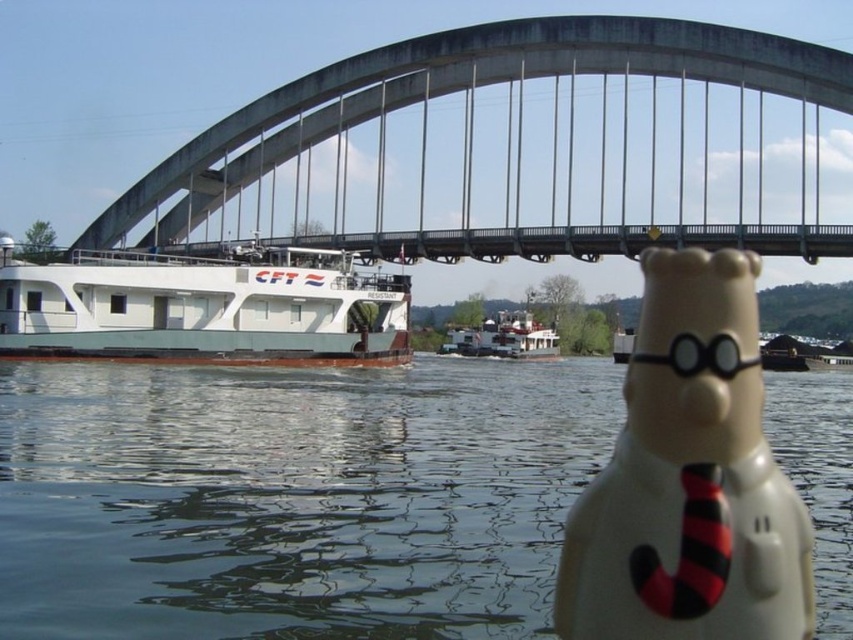
Can you confirm if transparent water at center is bigger than white matte barge at left?

Correct, transparent water at center is larger in size than white matte barge at left.

Is point (537, 545) more distant than point (61, 352)?

That is False.

You are a GUI agent. You are given a task and a screenshot of the screen. Output one action in this format:
    pyautogui.click(x=<x>, y=<y>)
    Task: Click on the transparent water at center
    
    Given the screenshot: What is the action you would take?
    pyautogui.click(x=293, y=497)

Is the position of transparent water at center less distant than that of white matte barge at center?

That is True.

Can you confirm if transparent water at center is positioned to the right of white matte barge at center?

No, transparent water at center is not to the right of white matte barge at center.

What do you see at coordinates (293, 497) in the screenshot? The width and height of the screenshot is (853, 640). I see `transparent water at center` at bounding box center [293, 497].

Locate an element on the screen. transparent water at center is located at coordinates (293, 497).

Is concrete bridge at upper center shorter than white matte barge at center?

Incorrect, concrete bridge at upper center's height does not fall short of white matte barge at center's.

Between point (701, 156) and point (485, 342), which one is positioned in front?

Point (701, 156)

Locate an element on the screen. Image resolution: width=853 pixels, height=640 pixels. concrete bridge at upper center is located at coordinates (521, 148).